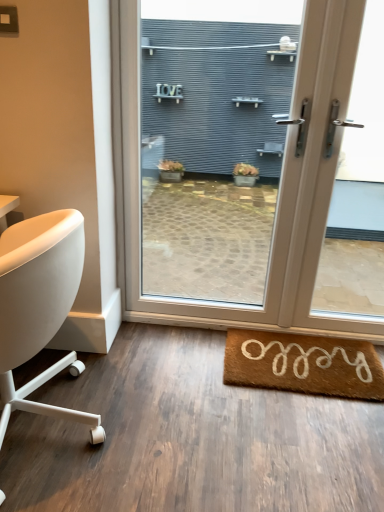
Describe the element at coordinates (303, 364) in the screenshot. I see `brown coir mat at lower right` at that location.

Find the location of a particular element. The image size is (384, 512). white leather chair at left is located at coordinates 39,306.

Is white glossy door at center inside brown coir mat at lower right?

No, brown coir mat at lower right does not contain white glossy door at center.

Considering the sizes of objects brown coir mat at lower right and white glossy door at center in the image provided, who is shorter, brown coir mat at lower right or white glossy door at center?

Standing shorter between the two is brown coir mat at lower right.

Is brown coir mat at lower right positioned with its back to white glossy door at center?

No, white glossy door at center is not at the back of brown coir mat at lower right.

Can you tell me how much brown coir mat at lower right and white glossy door at center differ in facing direction?

brown coir mat at lower right and white glossy door at center are facing 2.39 degrees away from each other.

From a real-world perspective, is white leather chair at left below white glossy door at center?

Yes, from a real-world perspective, white leather chair at left is under white glossy door at center.

Does white leather chair at left have a lesser height compared to white glossy door at center?

Indeed, white leather chair at left has a lesser height compared to white glossy door at center.

Is point (15, 298) closer or farther from the camera than point (125, 61)?

Clearly, point (15, 298) is closer to the camera than point (125, 61).

Is white leather chair at left facing towards white glossy door at center?

No, white leather chair at left is not turned towards white glossy door at center.

Relative to white leather chair at left, is white glossy door at center in front or behind?

In the image, white glossy door at center appears behind white leather chair at left.

Find the location of `chair lying on the left of white glossy door at center`. chair lying on the left of white glossy door at center is located at coordinates (39, 306).

Is white glossy door at center not close to white leather chair at left?

white glossy door at center is actually quite close to white leather chair at left.

How far apart are white glossy door at center and white leather chair at left?

The distance of white glossy door at center from white leather chair at left is 32.87 inches.

From a real-world perspective, who is located higher, brown coir mat at lower right or white leather chair at left?

white leather chair at left is physically above.

Between brown coir mat at lower right and white leather chair at left, which one has larger size?

white leather chair at left is bigger.

Is brown coir mat at lower right turned away from white leather chair at left?

No, brown coir mat at lower right's orientation is not away from white leather chair at left.

Is there a large distance between brown coir mat at lower right and white leather chair at left?

No, brown coir mat at lower right is not far from white leather chair at left.

In the scene shown: Is white plastic door at center located outside white leather chair at left?

Indeed, white plastic door at center is completely outside white leather chair at left.

What's the angular difference between white plastic door at center and white leather chair at left's facing directions?

The angle between the facing direction of white plastic door at center and the facing direction of white leather chair at left is 88.4 degrees.

Considering their positions, is white plastic door at center located in front of or behind white leather chair at left?

Visually, white plastic door at center is located behind white leather chair at left.

Find the location of `chair that is below the white plastic door at center (from the image's perspective)`. chair that is below the white plastic door at center (from the image's perspective) is located at coordinates (39, 306).

From a real-world perspective, is white plastic door at center positioned under white glossy door at center based on gravity?

Correct, in the physical world, white plastic door at center is lower than white glossy door at center.

Considering the relative sizes of white plastic door at center and white glossy door at center in the image provided, is white plastic door at center bigger than white glossy door at center?

Incorrect, white plastic door at center is not larger than white glossy door at center.

Is white plastic door at center to the left of white glossy door at center from the viewer's perspective?

No.

Does white plastic door at center have a greater height compared to white glossy door at center?

Yes.

From the image's perspective, is white glossy door at center on top of brown coir mat at lower right?

Yes.

Is white glossy door at center outside of brown coir mat at lower right?

Yes, white glossy door at center is not within brown coir mat at lower right.

Does white glossy door at center have a greater width compared to brown coir mat at lower right?

No, white glossy door at center is not wider than brown coir mat at lower right.

Considering the sizes of objects white glossy door at center and brown coir mat at lower right in the image provided, who is shorter, white glossy door at center or brown coir mat at lower right?

brown coir mat at lower right is shorter.

Find the location of a particular element. The image size is (384, 512). mat behind the white glossy door at center is located at coordinates (303, 364).

Image resolution: width=384 pixels, height=512 pixels. Find the location of `chair located underneath the white glossy door at center (from a real-world perspective)`. chair located underneath the white glossy door at center (from a real-world perspective) is located at coordinates (39, 306).

Looking at the image, which one is located further to brown coir mat at lower right, white leather chair at left or white plastic door at center?

white leather chair at left is positioned further to the anchor brown coir mat at lower right.

Which object lies nearer to the anchor point brown coir mat at lower right, white leather chair at left or white glossy door at center?

white glossy door at center is closer to brown coir mat at lower right.

When comparing their distances from white leather chair at left, does white plastic door at center or white glossy door at center seem closer?

white glossy door at center.

Looking at the image, which one is located further to white glossy door at center, white leather chair at left or white plastic door at center?

white leather chair at left is positioned further to the anchor white glossy door at center.

Which object lies further to the anchor point brown coir mat at lower right, white plastic door at center or white glossy door at center?

white glossy door at center is further to brown coir mat at lower right.

From the image, which object appears to be farther from white plastic door at center, white glossy door at center or white leather chair at left?

white leather chair at left.

Based on the photo, looking at the image, which one is located closer to white glossy door at center, white plastic door at center or brown coir mat at lower right?

white plastic door at center lies closer to white glossy door at center than the other object.

Considering their positions, is white glossy door at center positioned further to brown coir mat at lower right than white leather chair at left?

white leather chair at left lies further to brown coir mat at lower right than the other object.

Where is `door between white leather chair at left and white plastic door at center`? This screenshot has width=384, height=512. door between white leather chair at left and white plastic door at center is located at coordinates (280, 188).

Locate an element on the screen. The width and height of the screenshot is (384, 512). mat located between white leather chair at left and white plastic door at center in the left-right direction is located at coordinates (303, 364).

The image size is (384, 512). In order to click on window that lies between white glossy door at center and brown coir mat at lower right from top to bottom in this screenshot , I will do `click(330, 194)`.

This screenshot has width=384, height=512. What are the coordinates of `door between white leather chair at left and brown coir mat at lower right in the horizontal direction` in the screenshot? It's located at (280, 188).